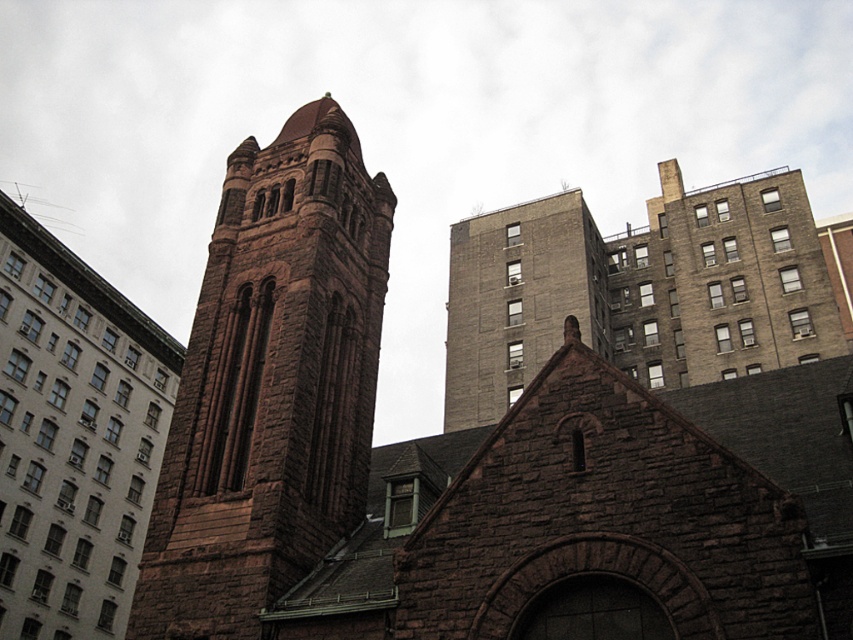
Is brown stone church at center bigger than brown stone church at left?

Yes, brown stone church at center is bigger than brown stone church at left.

Can you confirm if brown stone church at center is positioned to the left of brown stone church at left?

No, brown stone church at center is not to the left of brown stone church at left.

Does point (628, 461) come behind point (108, 573)?

No, it is in front of (108, 573).

Locate an element on the screen. This screenshot has height=640, width=853. brown stone church at center is located at coordinates (505, 420).

Is the position of brown stone tower at center more distant than that of brown stone building at upper center?

No, it is not.

Can you confirm if brown stone tower at center is positioned above brown stone building at upper center?

No.

Find the location of a particular element. The height and width of the screenshot is (640, 853). brown stone tower at center is located at coordinates (271, 385).

Does point (306, 259) come closer to viewer compared to point (48, 620)?

Yes, point (306, 259) is in front of point (48, 620).

Which of these two, brown stone tower at center or brown stone church at left, stands shorter?

Standing shorter between the two is brown stone tower at center.

Find the location of `brown stone tower at center`. brown stone tower at center is located at coordinates (271, 385).